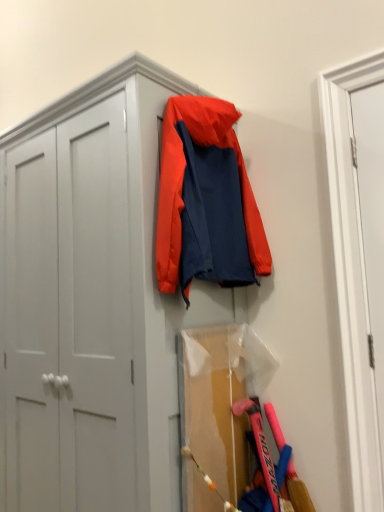
Question: Can you confirm if matte white cabinet at upper left is taller than white smooth door at right, which ranks as the first door in right-to-left order?

Choices:
 (A) yes
 (B) no

Answer: (A)

Question: Is matte white cabinet at upper left oriented towards white smooth door at right, acting as the 2th door starting from the left?

Choices:
 (A) no
 (B) yes

Answer: (A)

Question: From the image's perspective, does matte white cabinet at upper left appear lower than white smooth door at right, acting as the 2th door starting from the left?

Choices:
 (A) no
 (B) yes

Answer: (B)

Question: Does matte white cabinet at upper left appear on the left side of white smooth door at right, acting as the 2th door starting from the left?

Choices:
 (A) yes
 (B) no

Answer: (A)

Question: From the image's perspective, is matte white cabinet at upper left on white smooth door at right, which ranks as the first door in right-to-left order?

Choices:
 (A) yes
 (B) no

Answer: (B)

Question: Is white smooth door at right, which ranks as the first door in right-to-left order, surrounded by matte white cabinet at upper left?

Choices:
 (A) yes
 (B) no

Answer: (B)

Question: Does orange fabric jacket at center have a larger size compared to matte white cabinet at upper left?

Choices:
 (A) yes
 (B) no

Answer: (B)

Question: From the image's perspective, does orange fabric jacket at center appear lower than matte white cabinet at upper left?

Choices:
 (A) no
 (B) yes

Answer: (A)

Question: Is orange fabric jacket at center thinner than matte white cabinet at upper left?

Choices:
 (A) no
 (B) yes

Answer: (B)

Question: Is orange fabric jacket at center closer to the viewer compared to matte white cabinet at upper left?

Choices:
 (A) no
 (B) yes

Answer: (A)

Question: Is orange fabric jacket at center surrounding matte white cabinet at upper left?

Choices:
 (A) no
 (B) yes

Answer: (A)

Question: Is orange fabric jacket at center to the left of matte white cabinet at upper left from the viewer's perspective?

Choices:
 (A) yes
 (B) no

Answer: (B)

Question: From the image's perspective, would you say white smooth door at right, acting as the 2th door starting from the left, is shown under orange fabric jacket at center?

Choices:
 (A) yes
 (B) no

Answer: (A)